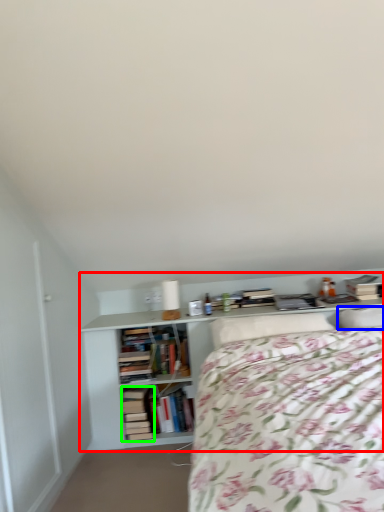
Question: Estimate the real-world distances between objects in this image. Which object is closer to shelf (highlighted by a red box), pillow (highlighted by a blue box) or book (highlighted by a green box)?

Choices:
 (A) pillow
 (B) book

Answer: (B)